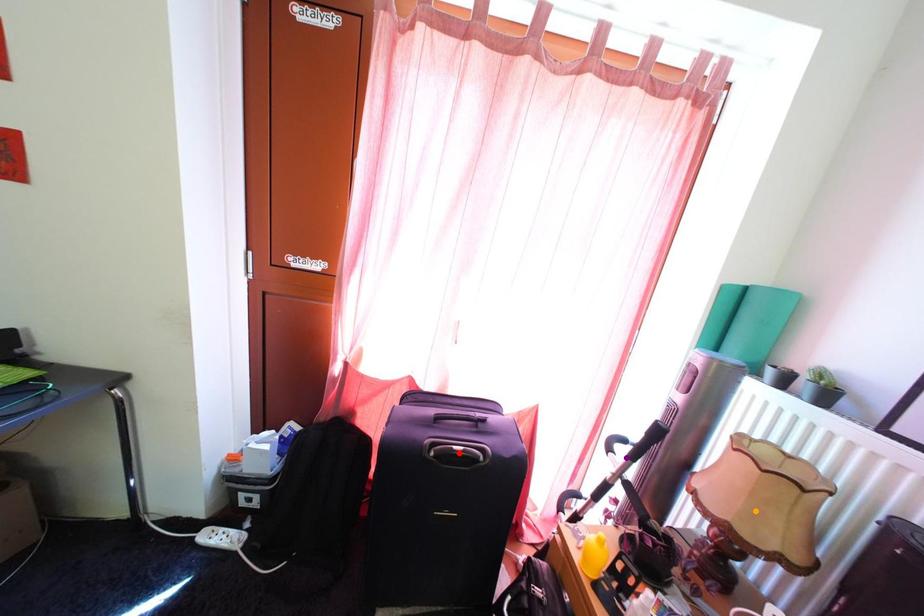
Order these from nearest to farthest:
A) orange point
B) purple point
C) red point

orange point → red point → purple point